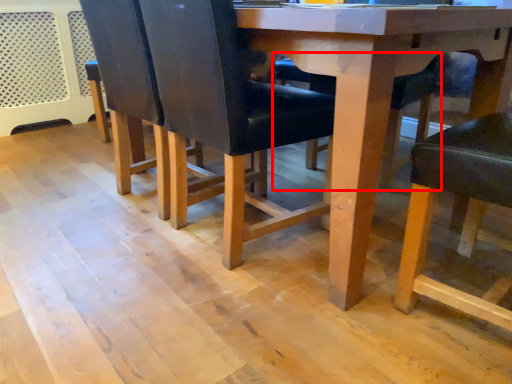
Question: From the image's perspective, considering the relative positions of chair (annotated by the red box) and chair in the image provided, where is chair (annotated by the red box) located with respect to the staircase?

Choices:
 (A) above
 (B) below

Answer: (A)